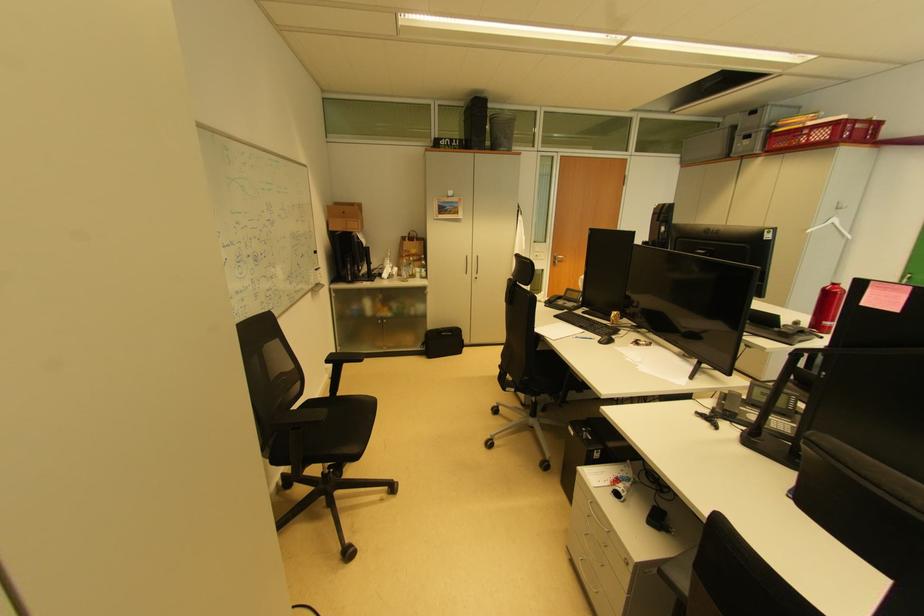
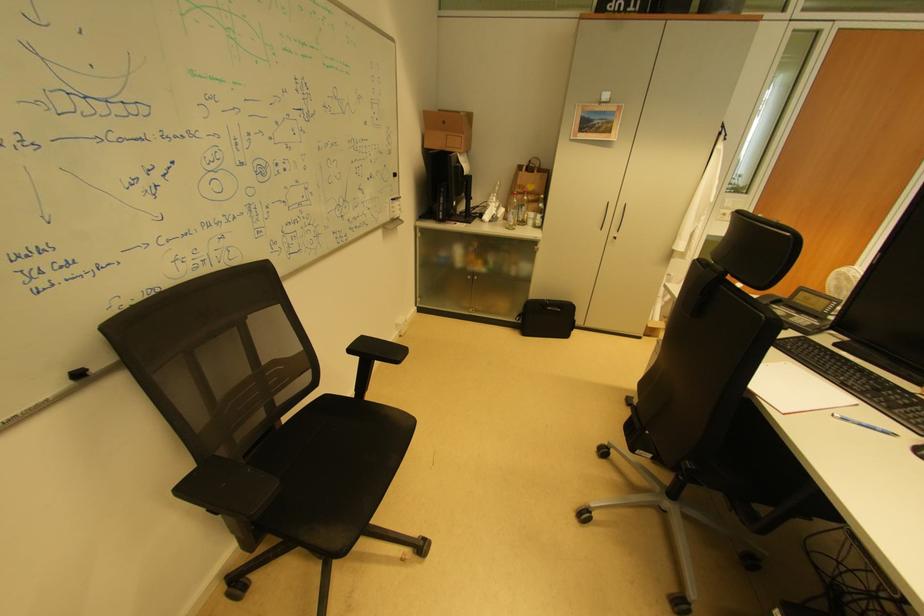
Where in the second image is the point corresponding to point (319, 405) from the first image?

(335, 400)